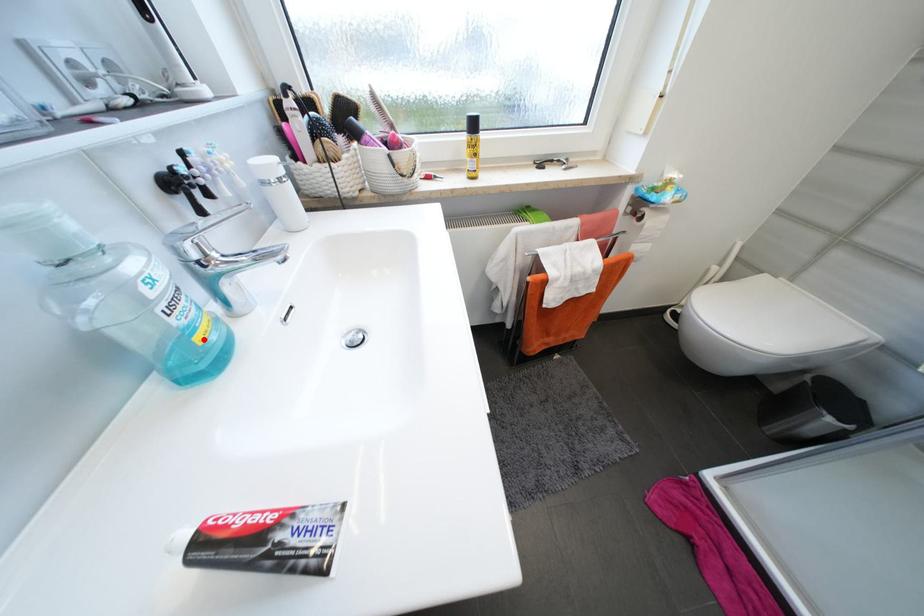
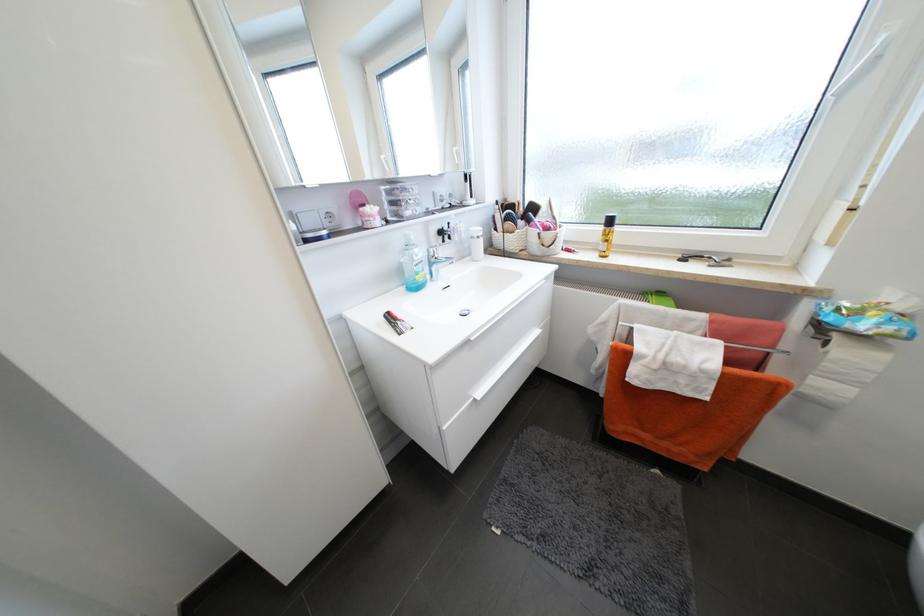
The point at the highlighted location is marked in the first image. Where is the corresponding point in the second image?

(423, 278)